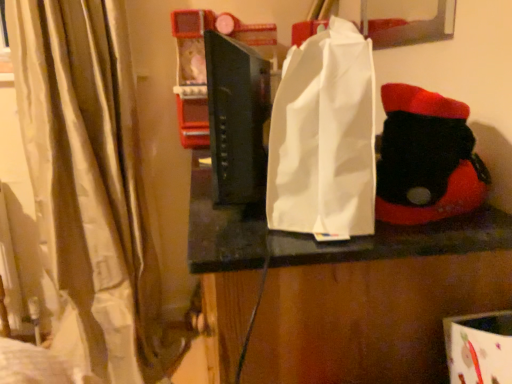
Where is `vacant space underneath black felt boot at right (from a real-world perspective)`? The image size is (512, 384). vacant space underneath black felt boot at right (from a real-world perspective) is located at coordinates (456, 221).